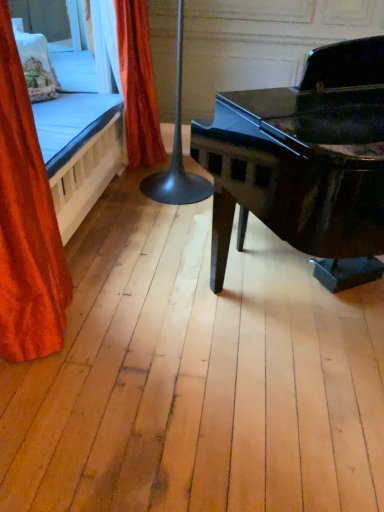
Question: From their relative heights in the image, would you say embroidered fabric pillow at upper left is taller or shorter than orange velvet curtain at upper left, which ranks as the 2th curtain in front-to-back order?

Choices:
 (A) tall
 (B) short

Answer: (B)

Question: Considering the positions of embroidered fabric pillow at upper left and orange velvet curtain at upper left, which ranks as the 2th curtain in front-to-back order, in the image, is embroidered fabric pillow at upper left wider or thinner than orange velvet curtain at upper left, which ranks as the 2th curtain in front-to-back order,?

Choices:
 (A) thin
 (B) wide

Answer: (A)

Question: Which is farther from the embroidered fabric pillow at upper left?

Choices:
 (A) orange velvet curtain at left, marked as the 1th curtain in a front-to-back arrangement
 (B) orange velvet curtain at upper left, which ranks as the 2th curtain in front-to-back order
 (C) black glossy table lamp at center

Answer: (A)

Question: Which is farther from the embroidered fabric pillow at upper left?

Choices:
 (A) orange velvet curtain at left, the second curtain positioned from the back
 (B) orange velvet curtain at upper left, which ranks as the 2th curtain in front-to-back order
 (C) black glossy table lamp at center

Answer: (A)